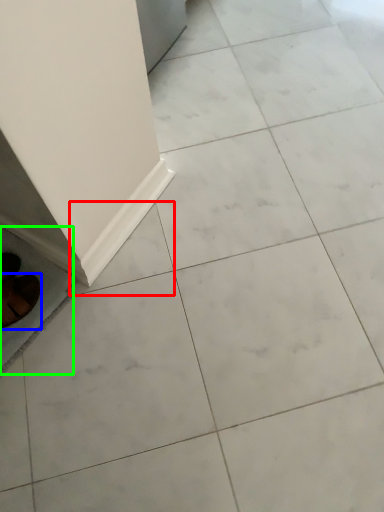
Question: Based on their relative distances, which object is nearer to ceramic tile (highlighted by a red box)? Choose from footwear (highlighted by a blue box) and ceramic tile (highlighted by a green box).

Choices:
 (A) footwear
 (B) ceramic tile

Answer: (B)